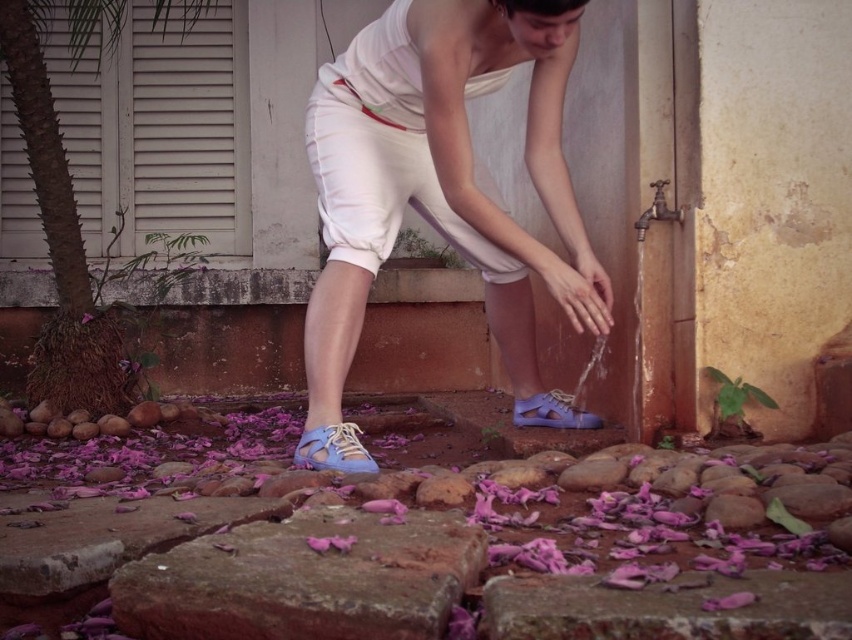
You are a gardener working in the courtyard. You notice the matte purple shoe at lower center and the purple matte flower at lower left. Which object has a greater width?

The matte purple shoe at lower center has a greater width than the purple matte flower at lower left.

You are a photographer trying to capture the person washing their hands. To get a clear shot of the matte white shorts at center without the purple matte flower at lower left blocking it, where should you position yourself relative to the scene?

Position yourself behind the matte white shorts at center so that it is between you and the purple matte flower at lower left. Since the matte white shorts at center is in front of the purple matte flower at lower left, this positioning will ensure the shorts are visible while the flower is obscured.

You are standing in the courtyard and want to pick up the purple matte flower at lower left. As you move towards it, will the matte purple shoe at lower center be in your path?

The matte purple shoe at lower center is closer to the viewer than the purple matte flower at lower left. Since the shoe is closer, it would be in your path when moving towards the flower.